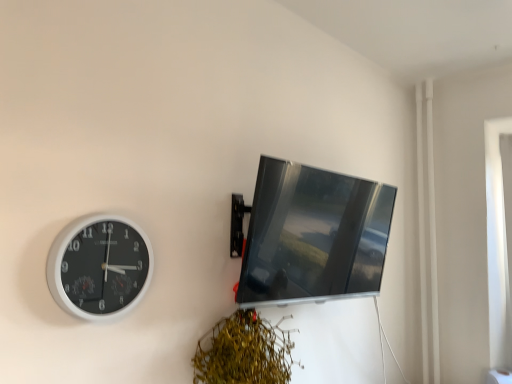
Locate an element on the screen. Image resolution: width=512 pixels, height=384 pixels. matte black monitor at upper right is located at coordinates (314, 236).

Locate an element on the screen. The image size is (512, 384). white plastic clock at left is located at coordinates (99, 267).

Where is `matte black monitor at upper right`? This screenshot has width=512, height=384. matte black monitor at upper right is located at coordinates (314, 236).

Is white plastic clock at left at the right side of matte black monitor at upper right?

Incorrect, white plastic clock at left is not on the right side of matte black monitor at upper right.

Does white plastic clock at left have a greater width compared to matte black monitor at upper right?

In fact, white plastic clock at left might be narrower than matte black monitor at upper right.

From a real-world perspective, who is located lower, white plastic clock at left or matte black monitor at upper right?

From a 3D spatial view, white plastic clock at left is below.

Between green leafy plant at lower center and white plastic clock at left, which one appears on the right side from the viewer's perspective?

Positioned to the right is green leafy plant at lower center.

Is green leafy plant at lower center inside the boundaries of white plastic clock at left, or outside?

The correct answer is: outside.

Considering the relative sizes of green leafy plant at lower center and white plastic clock at left in the image provided, is green leafy plant at lower center taller than white plastic clock at left?

Indeed, green leafy plant at lower center has a greater height compared to white plastic clock at left.

Do you think matte black monitor at upper right is within green leafy plant at lower center, or outside of it?

matte black monitor at upper right is outside green leafy plant at lower center.

How different are the orientations of matte black monitor at upper right and green leafy plant at lower center in degrees?

They differ by 0.000673 degrees in their facing directions.

Considering the relative sizes of matte black monitor at upper right and green leafy plant at lower center in the image provided, is matte black monitor at upper right bigger than green leafy plant at lower center?

Correct, matte black monitor at upper right is larger in size than green leafy plant at lower center.

Visually, is matte black monitor at upper right positioned to the left or to the right of green leafy plant at lower center?

matte black monitor at upper right is to the right of green leafy plant at lower center.

From the image's perspective, would you say green leafy plant at lower center is positioned over matte black monitor at upper right?

No, from the image's perspective, green leafy plant at lower center is not over matte black monitor at upper right.

How many degrees apart are the facing directions of green leafy plant at lower center and matte black monitor at upper right?

There is a 0.000673-degree angle between the facing directions of green leafy plant at lower center and matte black monitor at upper right.

From the picture: Does green leafy plant at lower center come in front of matte black monitor at upper right?

Yes, green leafy plant at lower center is closer to the viewer.

Does green leafy plant at lower center have a greater width compared to matte black monitor at upper right?

Indeed, green leafy plant at lower center has a greater width compared to matte black monitor at upper right.

Which object is thinner, matte black monitor at upper right or white plastic clock at left?

white plastic clock at left.

Is matte black monitor at upper right positioned beyond the bounds of white plastic clock at left?

matte black monitor at upper right lies outside white plastic clock at left's area.

Based on their positions, is matte black monitor at upper right located to the left or right of white plastic clock at left?

Based on their positions, matte black monitor at upper right is located to the right of white plastic clock at left.

This screenshot has height=384, width=512. I want to click on computer monitor above the white plastic clock at left (from a real-world perspective), so click(314, 236).

From the picture: Between white plastic clock at left and green leafy plant at lower center, which one has smaller size?

Smaller between the two is white plastic clock at left.

Is white plastic clock at left shorter than green leafy plant at lower center?

Indeed, white plastic clock at left has a lesser height compared to green leafy plant at lower center.

Does white plastic clock at left have a lesser width compared to green leafy plant at lower center?

Indeed, white plastic clock at left has a lesser width compared to green leafy plant at lower center.

Where is `wall clock lying on the left of matte black monitor at upper right`? wall clock lying on the left of matte black monitor at upper right is located at coordinates (99, 267).

Locate an element on the screen. The image size is (512, 384). wall clock lying above the green leafy plant at lower center (from the image's perspective) is located at coordinates (x=99, y=267).

Considering their positions, is matte black monitor at upper right positioned closer to green leafy plant at lower center than white plastic clock at left?

Among the two, matte black monitor at upper right is located nearer to green leafy plant at lower center.

Which object lies nearer to the anchor point white plastic clock at left, green leafy plant at lower center or matte black monitor at upper right?

green leafy plant at lower center.

From the image, which object appears to be farther from matte black monitor at upper right, green leafy plant at lower center or white plastic clock at left?

white plastic clock at left is positioned further to the anchor matte black monitor at upper right.

Estimate the real-world distances between objects in this image. Which object is closer to matte black monitor at upper right, white plastic clock at left or green leafy plant at lower center?

green leafy plant at lower center is closer to matte black monitor at upper right.

Estimate the real-world distances between objects in this image. Which object is closer to green leafy plant at lower center, white plastic clock at left or matte black monitor at upper right?

The object closer to green leafy plant at lower center is matte black monitor at upper right.

Looking at this image, from the image, which object appears to be farther from white plastic clock at left, matte black monitor at upper right or green leafy plant at lower center?

matte black monitor at upper right.

Identify the location of vegetation situated between white plastic clock at left and matte black monitor at upper right from left to right. (244, 351).